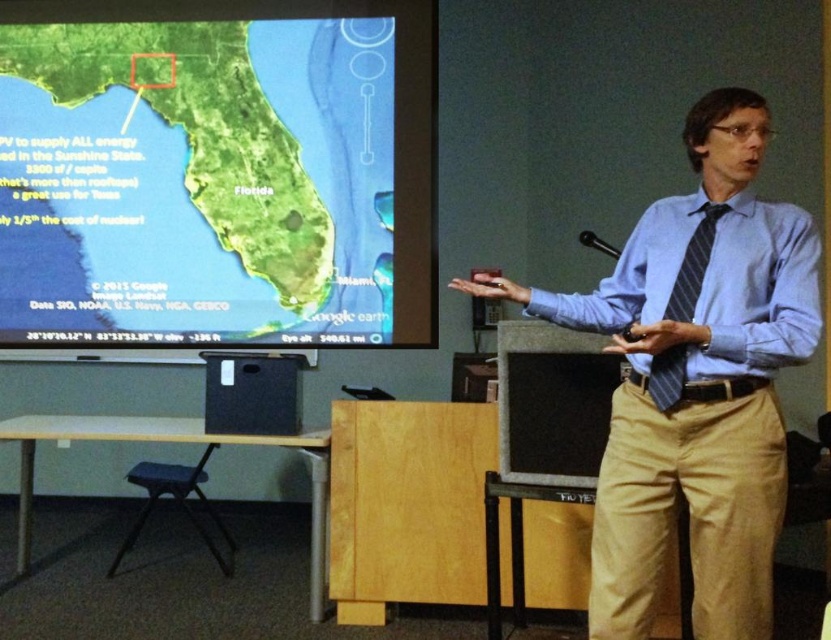
You are organizing a conference and need to place a 30 cm wide banner between the black plastic podium at lower left and the black matte speaker at center. Can the banner fit between them?

The black plastic podium at lower left and black matte speaker at center are 28.42 centimeters apart, so the 30 cm wide banner cannot fit between them as the distance is shorter than the banner.

You are an attendee at the presentation. You want to take a photo of the speaker without blocking anyone. The blue striped dress shirt at right and wooden stool at lower left are in your line of sight. Which object should you move to avoid blocking the view?

You should move the wooden stool at lower left because the blue striped dress shirt at right is in front of it, so moving the stool won

You are an event planner setting up the stage. You have to place a decorative plant between the black plastic podium at lower left and the black matte speaker at center. Where should you place it so that it is equidistant from both objects?

The black plastic podium at lower left is positioned under the black matte speaker at center, so placing the plant directly between them along the vertical axis would ensure it is equidistant from both objects.